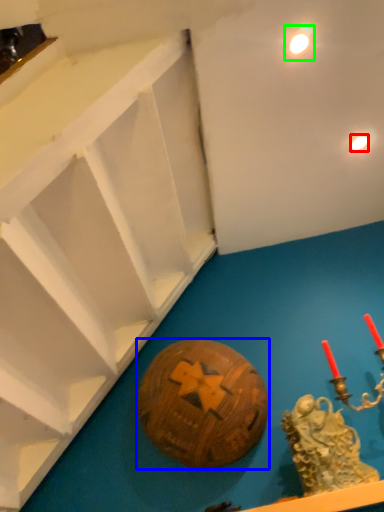
Question: Which object is the farthest from light (highlighted by a red box)? Choose among these: ball (highlighted by a blue box) or light (highlighted by a green box).

Choices:
 (A) ball
 (B) light

Answer: (A)